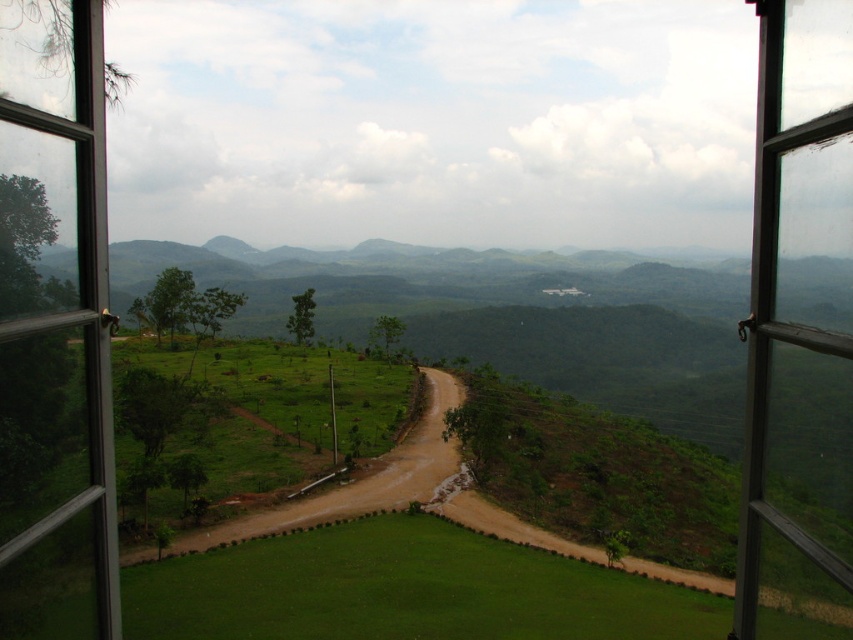
You are standing in a room and looking through the clear glass window at left and the clear glass window at right. If you want to place a 8 feet long ladder between them, will it fit without bending?

The clear glass window at left is 7.96 feet away from clear glass window at right. Since the ladder is 8 feet long, it will not fit between them as the distance is slightly shorter than the ladder.

You are standing in a room and want to take a photo of the clear glass window at left through the camera. The camera requires a minimum distance of 8 feet to focus properly. Can you take the photo without moving either the camera or the window?

The clear glass window at left and camera are 8.48 feet apart, which is more than the minimum 8 feet required. Therefore, you can take the photo without moving either the camera or the window.

You are standing in a room looking through the clear glass window at left and the brown dirt track at lower left. Which object is positioned to the right of the other?

The clear glass window at left is to the right of the brown dirt track at lower left.